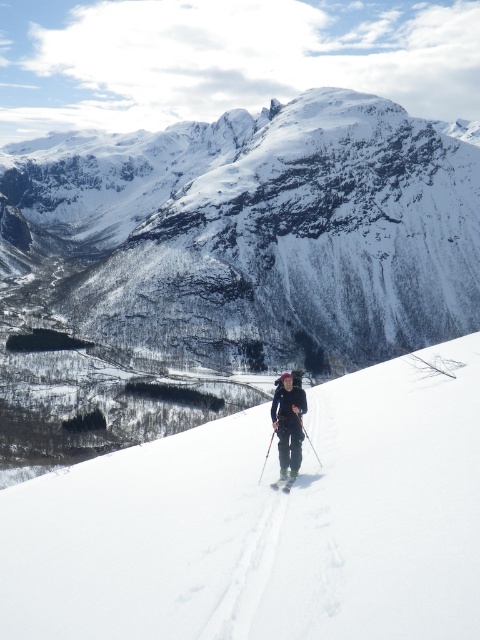
Question: Observing the image, what is the correct spatial positioning of white matte ski at center in reference to black plastic ski pole at center?

Choices:
 (A) above
 (B) below

Answer: (B)

Question: Is dark gray fabric jacket at center behind white matte ski at center?

Choices:
 (A) yes
 (B) no

Answer: (B)

Question: Is white snow-covered mountain at upper center bigger than white matte ski at center?

Choices:
 (A) yes
 (B) no

Answer: (A)

Question: Estimate the real-world distances between objects in this image. Which object is closer to the white matte ski at center?

Choices:
 (A) silver metallic ski pole at center
 (B) black plastic ski pole at center
 (C) white snow-covered mountain at upper center
 (D) dark gray fabric jacket at center

Answer: (D)

Question: Which object appears farthest from the camera in this image?

Choices:
 (A) white matte ski at center
 (B) white snow-covered mountain at upper center

Answer: (B)

Question: Among these objects, which one is nearest to the camera?

Choices:
 (A) silver metallic ski pole at center
 (B) white matte ski at center

Answer: (B)